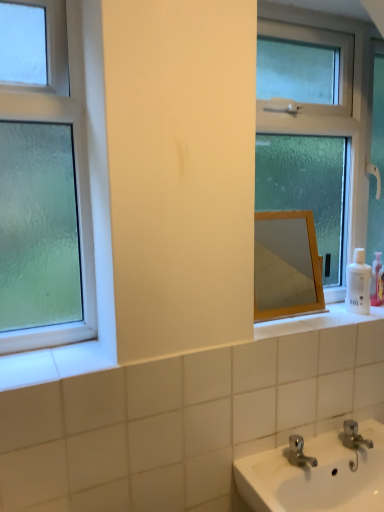
Question: From a real-world perspective, does white plastic bottle at right stand above wooden mirror at center?

Choices:
 (A) no
 (B) yes

Answer: (A)

Question: Would you say white plastic bottle at right is a long distance from wooden mirror at center?

Choices:
 (A) no
 (B) yes

Answer: (B)

Question: Is wooden mirror at center inside white plastic bottle at right?

Choices:
 (A) no
 (B) yes

Answer: (A)

Question: Is white plastic bottle at right behind wooden mirror at center?

Choices:
 (A) no
 (B) yes

Answer: (B)

Question: Can you confirm if white plastic bottle at right is taller than wooden mirror at center?

Choices:
 (A) yes
 (B) no

Answer: (B)

Question: Could you tell me if white plastic bottle at right is facing wooden mirror at center?

Choices:
 (A) no
 (B) yes

Answer: (A)

Question: Is clear glass window at center, arranged as the second window when viewed from the front, taller than white plastic bottle at right?

Choices:
 (A) yes
 (B) no

Answer: (A)

Question: Is the depth of clear glass window at center, placed as the 2th window when sorted from left to right, greater than that of white plastic bottle at right?

Choices:
 (A) no
 (B) yes

Answer: (A)

Question: From the image's perspective, would you say clear glass window at center, marked as the first window in a back-to-front arrangement, is shown under white plastic bottle at right?

Choices:
 (A) yes
 (B) no

Answer: (B)

Question: Does clear glass window at center, arranged as the second window when viewed from the front, have a smaller size compared to white plastic bottle at right?

Choices:
 (A) yes
 (B) no

Answer: (B)

Question: Is clear glass window at center, which ranks as the first window in right-to-left order, turned away from white plastic bottle at right?

Choices:
 (A) yes
 (B) no

Answer: (A)

Question: Is white plastic bottle at right inside clear glass window at center, which ranks as the first window in right-to-left order?

Choices:
 (A) yes
 (B) no

Answer: (B)

Question: Is wooden mirror at center at the left side of clear glass window at center, which ranks as the first window in right-to-left order?

Choices:
 (A) no
 (B) yes

Answer: (B)